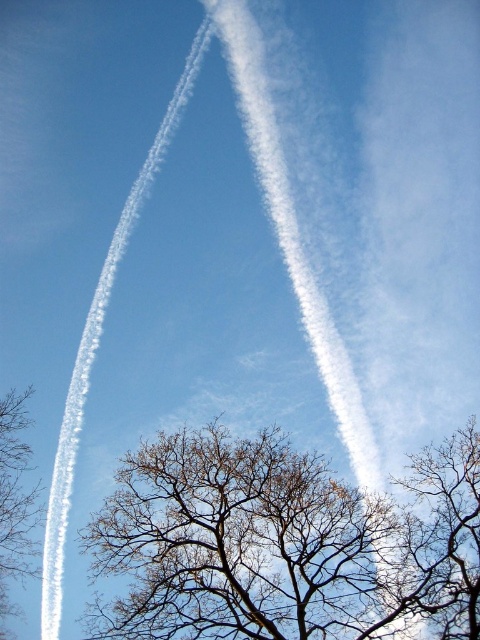
You are a bird flying between the two contrails in the sky. The contrails are white streaks left by planes. You notice there are bare branches at center below you. How far apart are the two contrails you are flying between?

The two contrails are 30.17 meters apart.

You are a bird looking for a sturdy perch in the scene. The bare branches at center and the brown leafless branches at left are both options. Based on their sizes, which branch would provide a more stable landing spot?

The bare branches at center has a larger size compared to brown leafless branches at left, so it would provide a more stable landing spot for the bird.

You are a bird flying towards the brown leafless branches at center and the brown leafless branches at left. Which branches will you reach first?

The brown leafless branches at center will be reached first because they are positioned in front of the brown leafless branches at left.